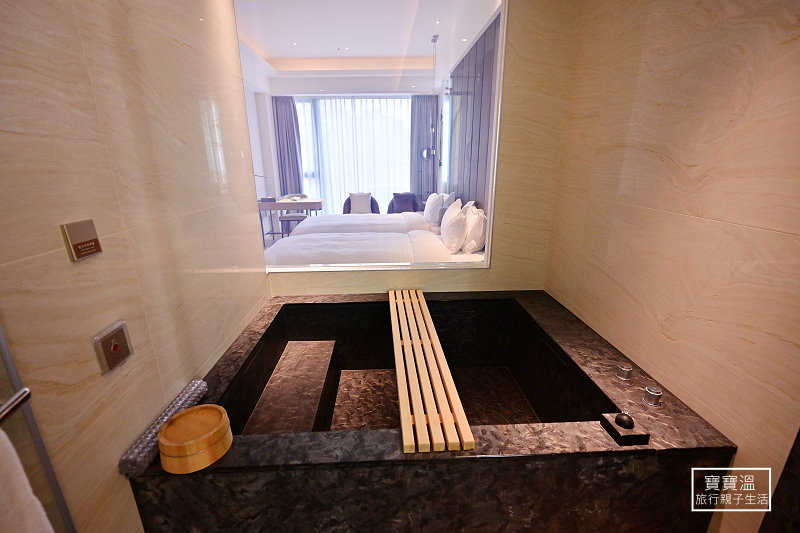
The width and height of the screenshot is (800, 533). I want to click on dark gray curtains, so click(x=292, y=135), click(x=424, y=128).